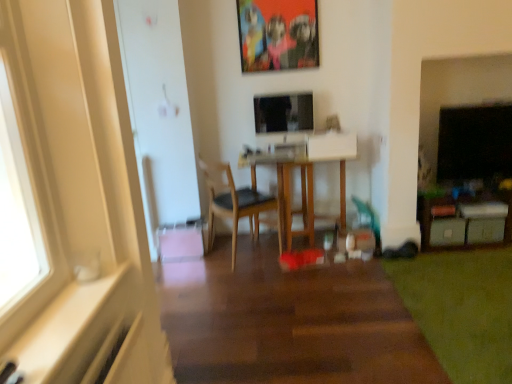
Question: Can you confirm if wooden table at center is bigger than white plastic drawer at lower right, the 2th drawer when ordered from left to right?

Choices:
 (A) no
 (B) yes

Answer: (B)

Question: Is wooden table at center behind white plastic drawer at lower right, the 1th drawer in the right-to-left sequence?

Choices:
 (A) no
 (B) yes

Answer: (B)

Question: From a real-world perspective, is wooden table at center located beneath white plastic drawer at lower right, the 2th drawer when ordered from left to right?

Choices:
 (A) no
 (B) yes

Answer: (A)

Question: Can you confirm if wooden table at center is positioned to the right of white plastic drawer at lower right, the 1th drawer in the right-to-left sequence?

Choices:
 (A) no
 (B) yes

Answer: (A)

Question: Is wooden table at center positioned in front of white plastic drawer at lower right, the 1th drawer in the right-to-left sequence?

Choices:
 (A) yes
 (B) no

Answer: (B)

Question: Is wooden table at center wider than white plastic drawer at lower right, the 2th drawer when ordered from left to right?

Choices:
 (A) no
 (B) yes

Answer: (B)

Question: Is satin black monitor at center to the right of wooden table at center from the viewer's perspective?

Choices:
 (A) no
 (B) yes

Answer: (A)

Question: Could you tell me if satin black monitor at center is facing wooden table at center?

Choices:
 (A) no
 (B) yes

Answer: (A)

Question: From the image's perspective, does satin black monitor at center appear higher than wooden table at center?

Choices:
 (A) yes
 (B) no

Answer: (A)

Question: Is satin black monitor at center beside wooden table at center?

Choices:
 (A) yes
 (B) no

Answer: (B)

Question: Considering the relative sizes of satin black monitor at center and wooden table at center in the image provided, is satin black monitor at center thinner than wooden table at center?

Choices:
 (A) yes
 (B) no

Answer: (A)

Question: Is satin black monitor at center shorter than wooden table at center?

Choices:
 (A) yes
 (B) no

Answer: (A)

Question: Is wooden table at center bigger than green soft carpet at lower right?

Choices:
 (A) no
 (B) yes

Answer: (B)